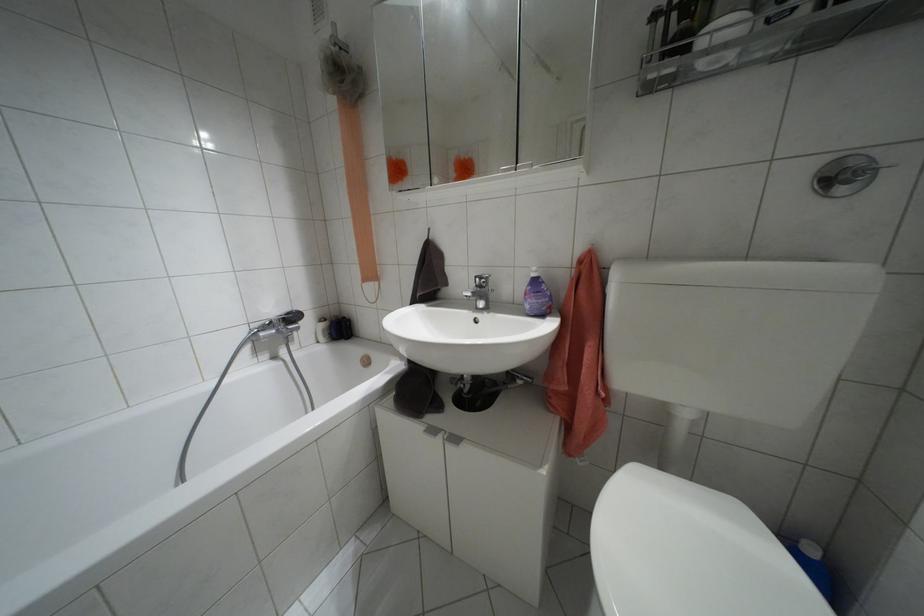
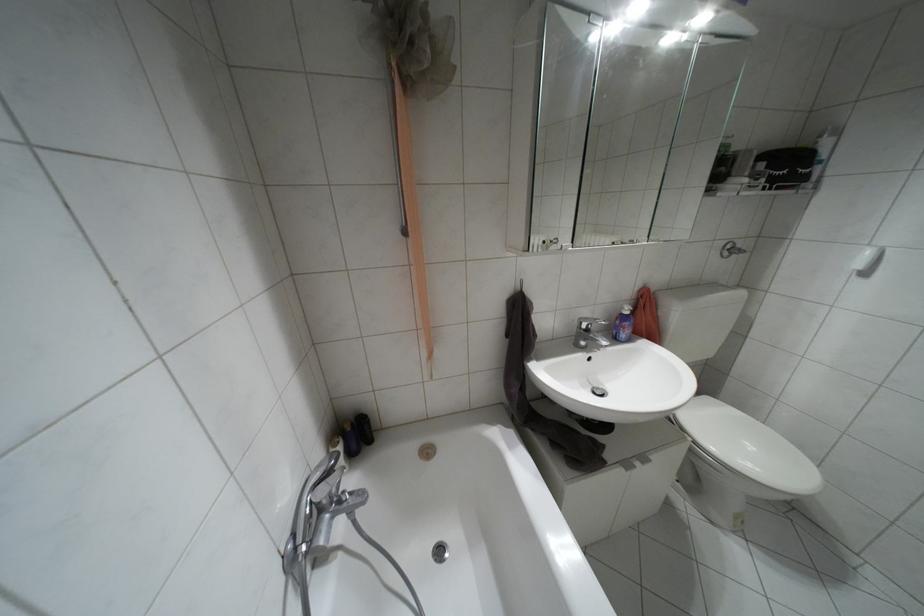
In the second image, find the point that corresponds to [841,190] in the first image.

(723, 254)